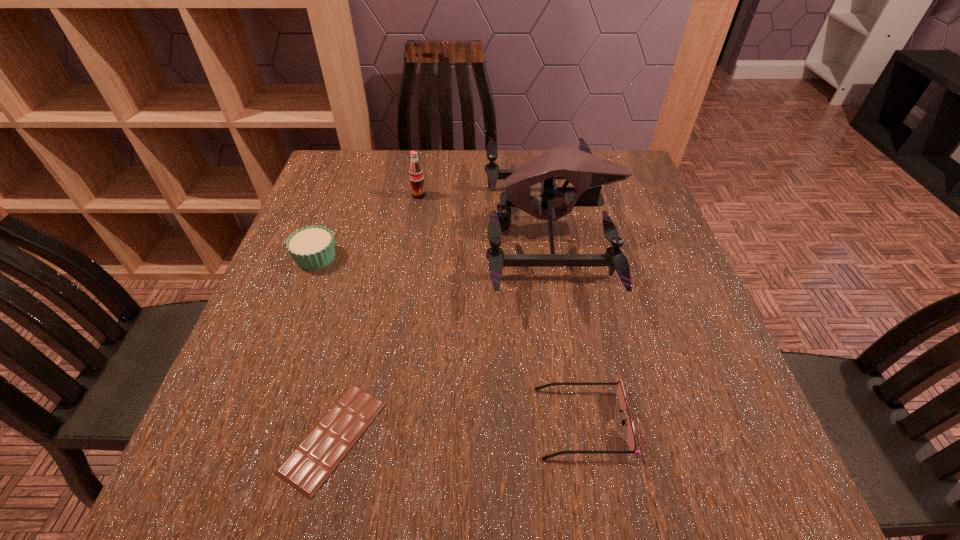
The image size is (960, 540). I want to click on the tallest object, so click(586, 172).

You are a GUI agent. You are given a task and a screenshot of the screen. Output one action in this format:
    pyautogui.click(x=<x>, y=<y>)
    Task: Click on the fourth shortest object
    
    Given the screenshot: What is the action you would take?
    pyautogui.click(x=416, y=175)

Image resolution: width=960 pixels, height=540 pixels. I want to click on cupcake, so click(312, 247).

Find the location of a particular element. Image resolution: width=960 pixels, height=540 pixels. the leftmost object is located at coordinates (312, 247).

Find the location of a particular element. This screenshot has height=540, width=960. sunglasses is located at coordinates [x=631, y=441].

The image size is (960, 540). I want to click on chocolate bar, so click(310, 464).

Where is `free region located on the front-facing side of the tallest object`? free region located on the front-facing side of the tallest object is located at coordinates (456, 229).

At what (x,y) coordinates should I click in order to perform the action: click on vacant space located 0.130m on the front-facing side of the tallest object. Please return your answer as a coordinate pair (x, y). Looking at the image, I should click on (432, 229).

Find the location of a particular element. The image size is (960, 540). free space located on the front-facing side of the tallest object is located at coordinates (420, 229).

The image size is (960, 540). In order to click on vacant space positioned 0.050m on the back of the fourth shortest object in this screenshot , I will do `click(421, 180)`.